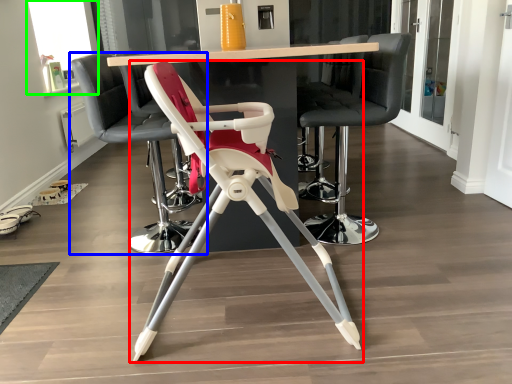
Question: Based on their relative distances, which object is nearer to chair (highlighted by a red box)? Choose from chair (highlighted by a blue box) and window screen (highlighted by a green box).

Choices:
 (A) chair
 (B) window screen

Answer: (A)